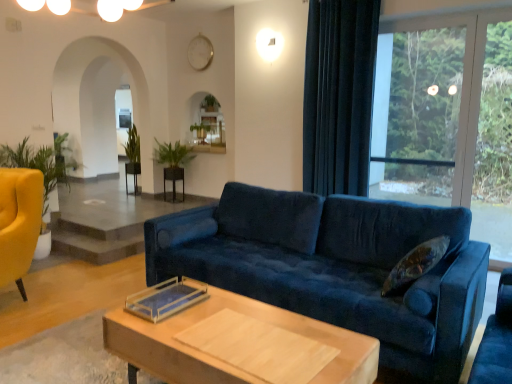
The image size is (512, 384). What are the coordinates of `vacant location below black wood side table at center, which is counted as the 2th side table, starting from the left (from a real-world perspective)` in the screenshot? It's located at pos(173,200).